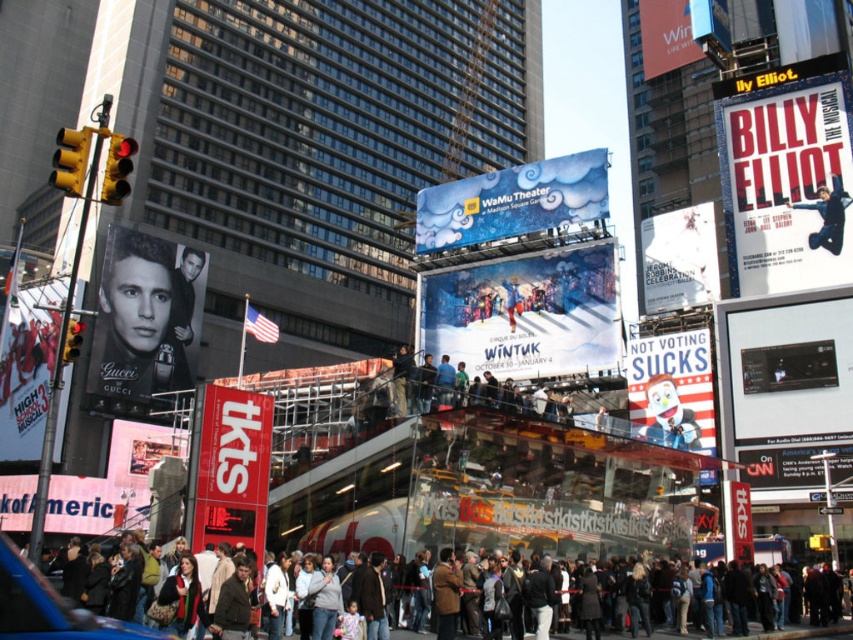
Is blue metallic car at lower left below white glossy sign at center?

No, blue metallic car at lower left is not below white glossy sign at center.

Which is above, blue metallic car at lower left or white glossy sign at center?

blue metallic car at lower left

Who is more forward, (32, 589) or (738, 451)?

Point (32, 589)

Identify the location of blue metallic car at lower left. The height and width of the screenshot is (640, 853). (50, 608).

Is blue fabric billboard at center shorter than white paper sign at center?

In fact, blue fabric billboard at center may be taller than white paper sign at center.

What do you see at coordinates (512, 202) in the screenshot? The image size is (853, 640). I see `blue fabric billboard at center` at bounding box center [512, 202].

I want to click on blue fabric billboard at center, so click(x=512, y=202).

Does point (833, 472) come farther from viewer compared to point (648, 33)?

No, (833, 472) is in front of (648, 33).

Between white glossy sign at center and matte white sign at upper right, which one appears on the left side from the viewer's perspective?

From the viewer's perspective, white glossy sign at center appears more on the left side.

Is point (752, 476) less distant than point (670, 61)?

That is True.

This screenshot has height=640, width=853. Identify the location of white glossy sign at center. (793, 467).